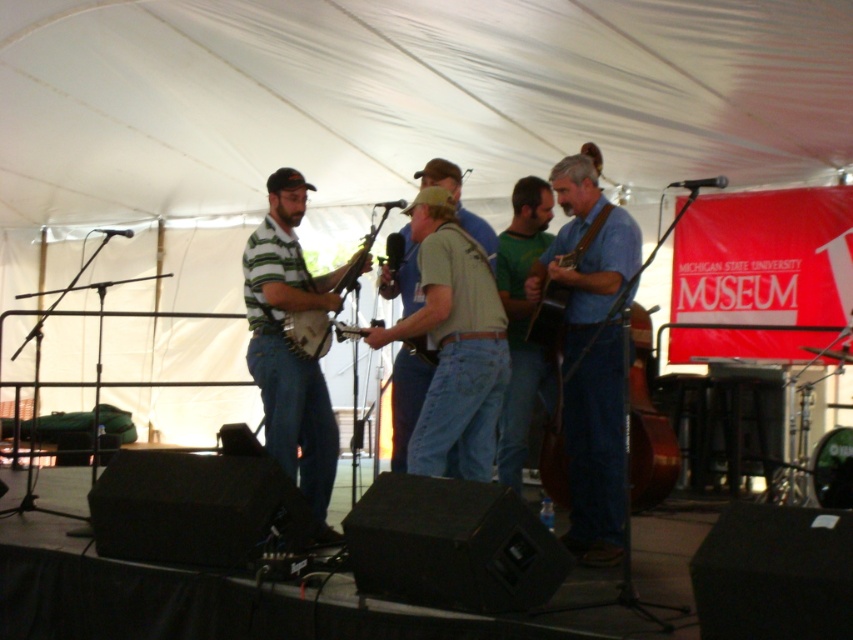
Is striped jersey banjo at center to the right of wooden banjo at center from the viewer's perspective?

In fact, striped jersey banjo at center is to the left of wooden banjo at center.

Which is behind, point (305, 445) or point (372, 224)?

Point (372, 224)

This screenshot has width=853, height=640. Find the location of `striped jersey banjo at center`. striped jersey banjo at center is located at coordinates (289, 348).

Who is more distant from viewer, (328, 429) or (636, 381)?

Positioned behind is point (328, 429).

At what (x,y) coordinates should I click in order to perform the action: click on striped jersey banjo at center. Please return your answer as a coordinate pair (x, y). Looking at the image, I should click on (289, 348).

Between point (596, 182) and point (361, 257), which one is positioned in front?

Point (596, 182)

You are a GUI agent. You are given a task and a screenshot of the screen. Output one action in this format:
    pyautogui.click(x=<x>, y=<y>)
    Task: Click on the blue denim jeans at center
    
    Given the screenshot: What is the action you would take?
    pyautogui.click(x=590, y=353)

Where is `blue denim jeans at center`? blue denim jeans at center is located at coordinates (590, 353).